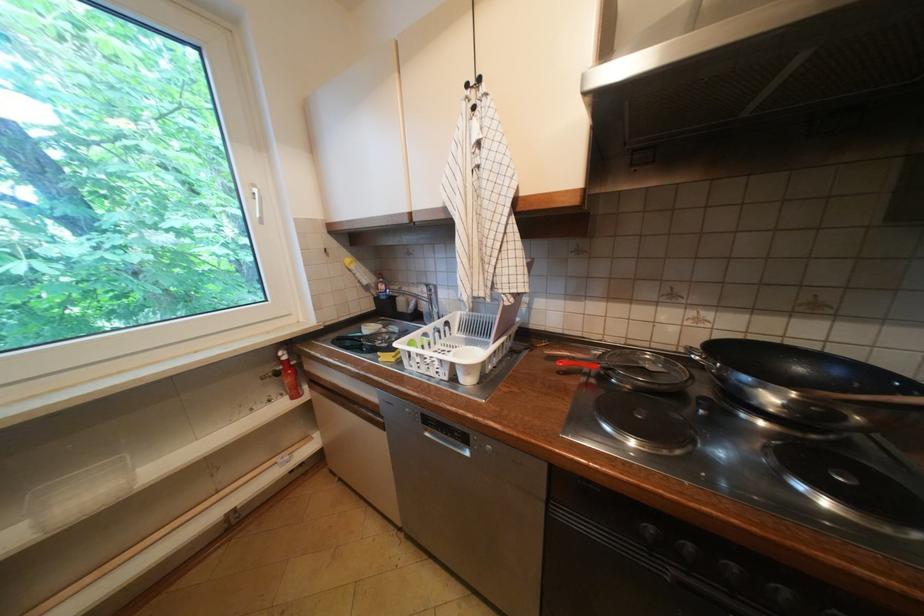
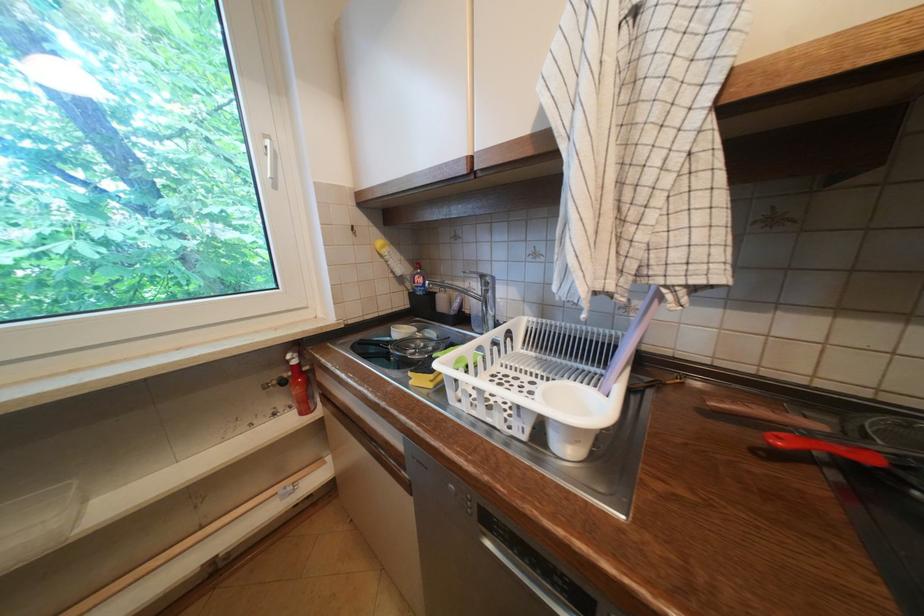
The point at (287, 359) is marked in the first image. Where is the corresponding point in the second image?

(296, 362)